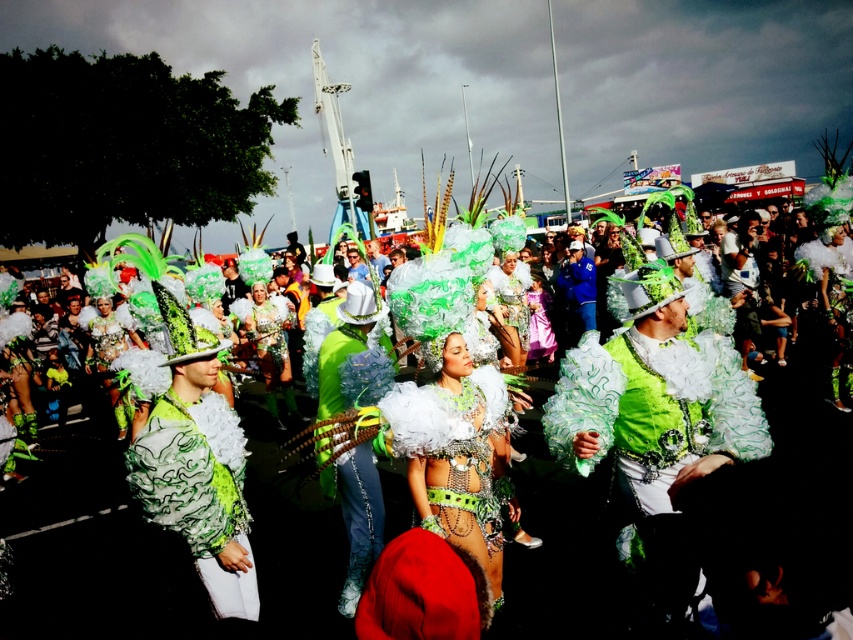
Which is in front, point (688, 413) or point (195, 531)?

Point (195, 531) is more forward.

Is green sequined jacket at center behind green matte fabric costume at center?

No, it is not.

This screenshot has height=640, width=853. Identify the location of green sequined jacket at center. (654, 428).

Is green shiny feathers at center thinner than green sequined jacket at center?

Correct, green shiny feathers at center's width is less than green sequined jacket at center's.

Between green shiny feathers at center and green sequined jacket at center, which one has more height?

green sequined jacket at center

I want to click on green shiny feathers at center, so click(x=158, y=550).

Is green shiny feathers at center behind green matte fabric costume at center?

Yes, green shiny feathers at center is behind green matte fabric costume at center.

Can you confirm if green shiny feathers at center is wider than green matte fabric costume at center?

No, green shiny feathers at center is not wider than green matte fabric costume at center.

Measure the distance between green shiny feathers at center and camera.

The distance of green shiny feathers at center from camera is 27.47 feet.

This screenshot has height=640, width=853. I want to click on green shiny feathers at center, so click(x=158, y=550).